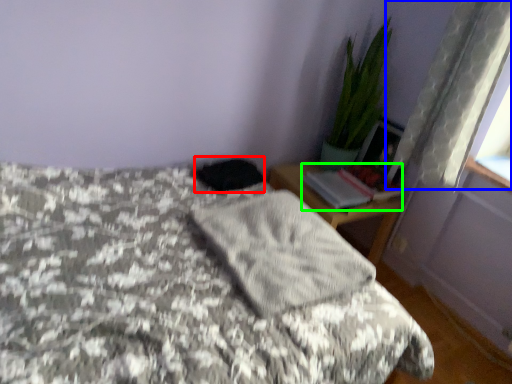
Question: Based on their relative distances, which object is farther from dark (highlighted by a red box)? Choose from curtain (highlighted by a blue box) and book (highlighted by a green box).

Choices:
 (A) curtain
 (B) book

Answer: (A)